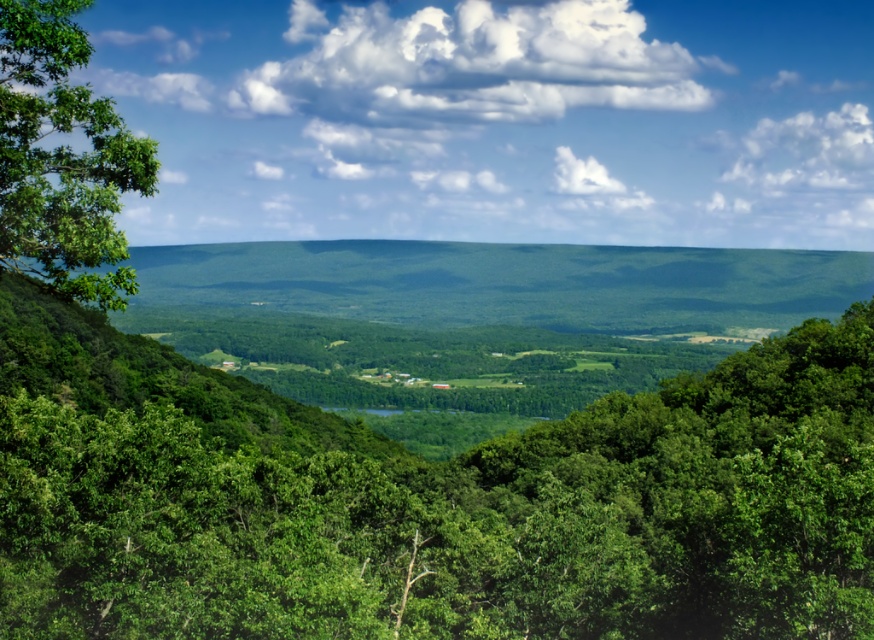
Is point (531, 618) closer to viewer compared to point (454, 163)?

Yes.

Does point (760, 477) come farther from viewer compared to point (810, 104)?

That is False.

Locate an element on the screen. green leafy tree at center is located at coordinates (463, 516).

Can you confirm if white fluffy cloud at upper center is wider than green leafy tree at left?

Yes, white fluffy cloud at upper center is wider than green leafy tree at left.

Is point (503, 163) farther from camera compared to point (128, 156)?

Yes.

This screenshot has height=640, width=874. Find the location of `white fluffy cloud at upper center`. white fluffy cloud at upper center is located at coordinates (497, 120).

In the scene shown: Between green leafy tree at center and green leafy tree at left, which one appears on the left side from the viewer's perspective?

Positioned to the left is green leafy tree at left.

Does green leafy tree at center have a greater height compared to green leafy tree at left?

Correct, green leafy tree at center is much taller as green leafy tree at left.

Does point (868, 324) come closer to viewer compared to point (63, 44)?

No, (868, 324) is further to viewer.

This screenshot has width=874, height=640. I want to click on green leafy tree at center, so click(x=463, y=516).